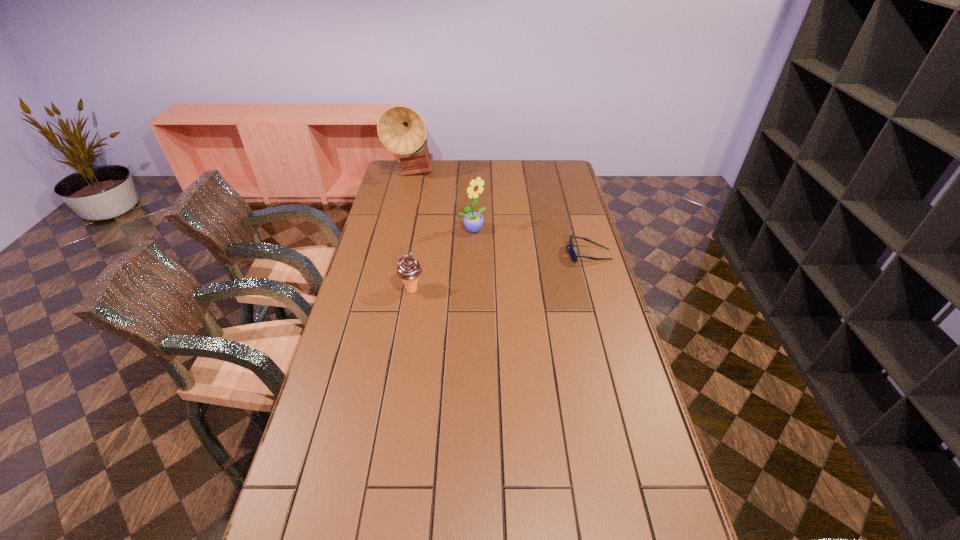
Find the location of a particular element. free space on the desktop that is between the nearest object and the rightmost object and is positioned on the front-facing side of the third nearest object is located at coordinates (529, 266).

Find the location of a particular element. The height and width of the screenshot is (540, 960). free space on the desktop that is between the icecream and the sunglasses and is positioned on the horn of the tallest object is located at coordinates (x=509, y=270).